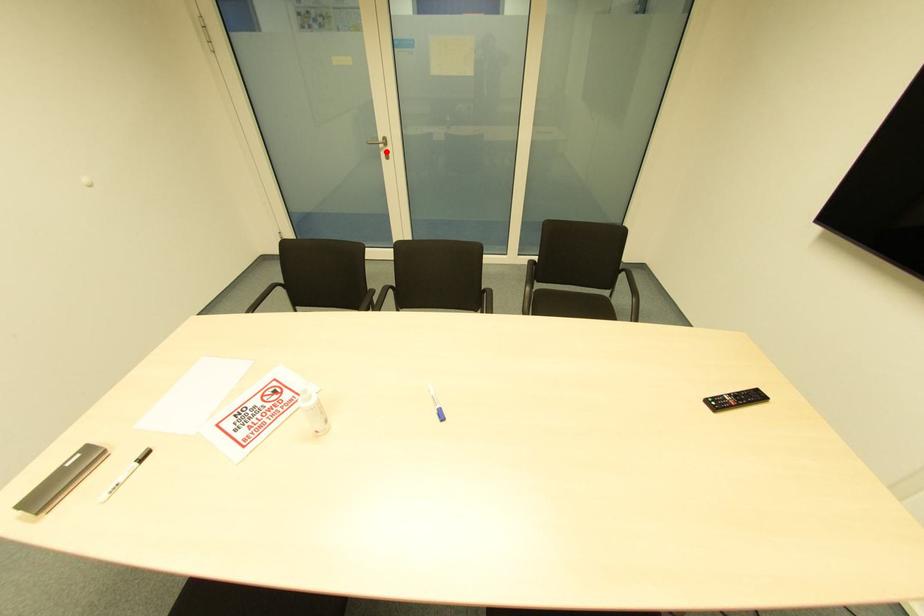
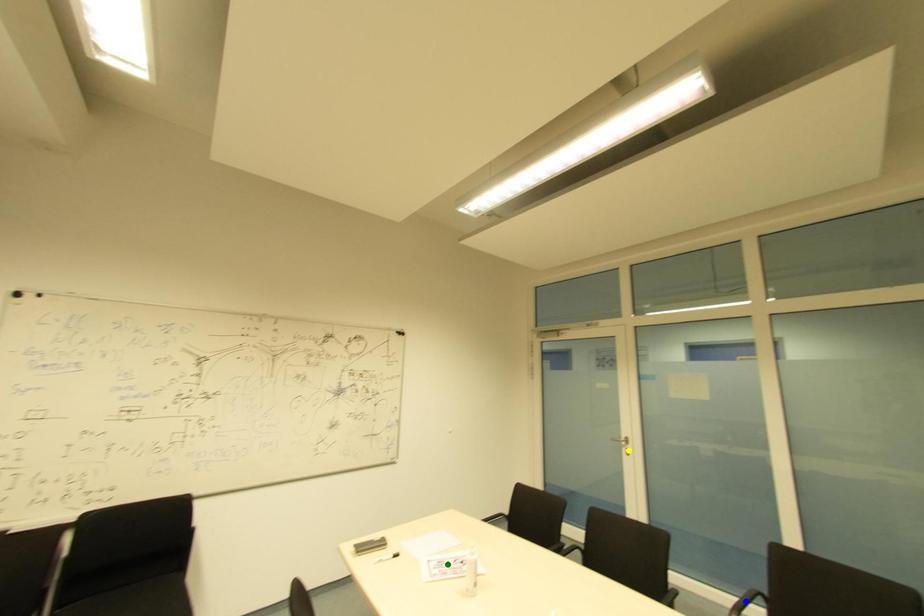
Question: I am providing you with two images of the same scene from different viewpoints. A red point is marked on the first image. You are given multiple points on the second image. Which mark in image 2 goes with the point in image 1?

Choices:
 (A) green point
 (B) yellow point
 (C) blue point

Answer: (B)